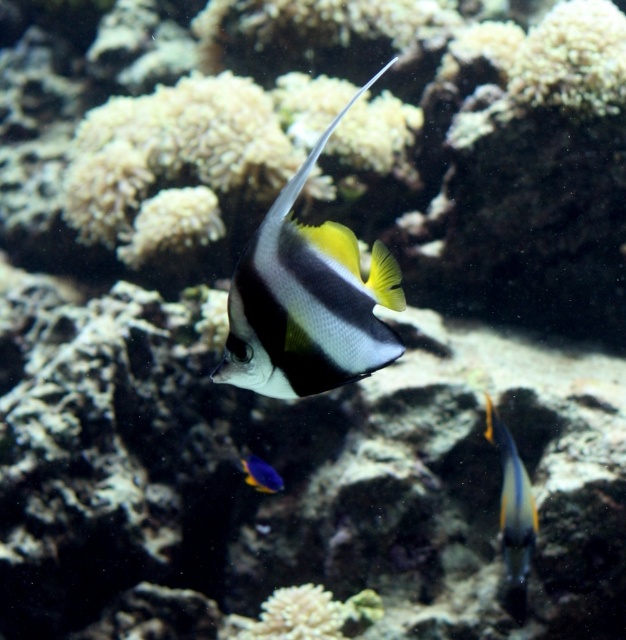
Question: Is black and white striped fish at center further to camera compared to shiny blue and yellow fish at center?

Choices:
 (A) no
 (B) yes

Answer: (A)

Question: Which object is the closest to the shiny blue and yellow fish at center?

Choices:
 (A) shiny blue fish at lower center
 (B) black and white striped fish at center

Answer: (A)

Question: Which point appears closest to the camera in this image?

Choices:
 (A) (500, 436)
 (B) (259, 481)

Answer: (A)

Question: Can you confirm if white coral at center is positioned above shiny blue fish at lower center?

Choices:
 (A) yes
 (B) no

Answer: (B)

Question: Is shiny blue and yellow fish at center thinner than shiny blue fish at lower center?

Choices:
 (A) yes
 (B) no

Answer: (B)

Question: Which object is farther from the camera taking this photo?

Choices:
 (A) black and white striped fish at center
 (B) shiny blue and yellow fish at center
 (C) shiny blue fish at lower center
 (D) white coral at center

Answer: (C)